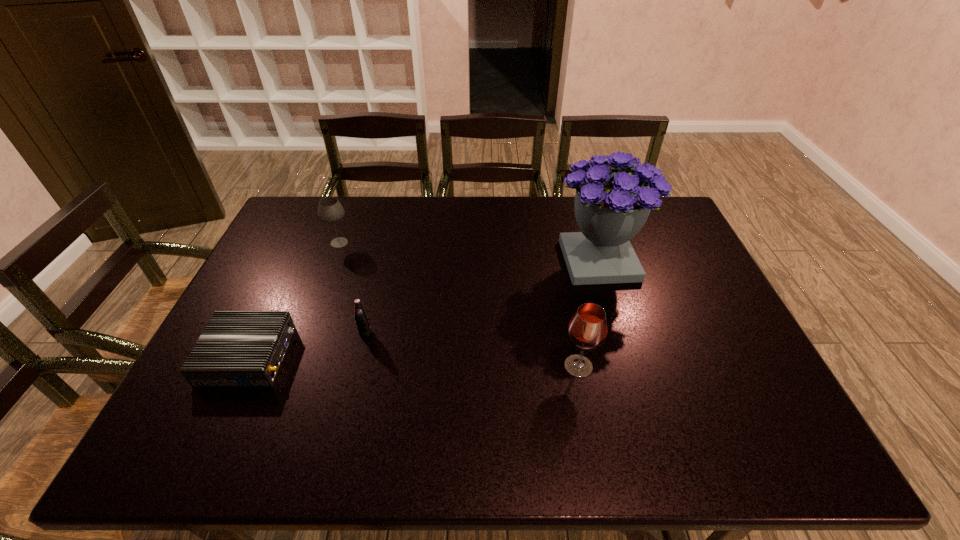
The height and width of the screenshot is (540, 960). I want to click on the tallest object, so click(611, 206).

Locate an element on the screen. the taller wineglass is located at coordinates (587, 329).

Identify the location of the right wineglass. The height and width of the screenshot is (540, 960). (587, 329).

Identify the location of the left wineglass. (330, 210).

Locate an element on the screen. The width and height of the screenshot is (960, 540). the farther wineglass is located at coordinates (330, 210).

Where is `pop`? This screenshot has width=960, height=540. pop is located at coordinates (361, 317).

In order to click on the second shortest object in this screenshot , I will do coord(361,317).

The width and height of the screenshot is (960, 540). I want to click on the shortest object, so click(237, 348).

You are a GUI agent. You are given a task and a screenshot of the screen. Output one action in this format:
    pyautogui.click(x=<x>, y=<y>)
    Task: Click on the vacant space situated on the back of the bouquet
    The image size is (960, 540).
    Given the screenshot: What is the action you would take?
    pyautogui.click(x=579, y=198)

Where is `free space located on the back of the nearer wineglass`? The width and height of the screenshot is (960, 540). free space located on the back of the nearer wineglass is located at coordinates (560, 272).